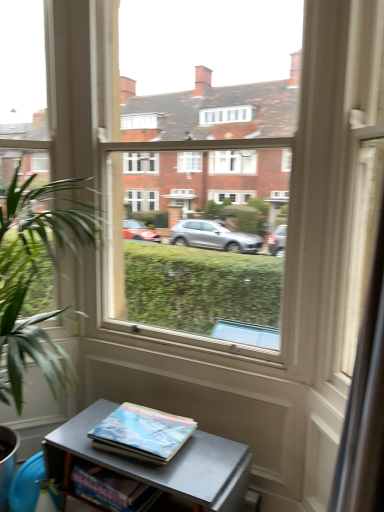
Question: Considering the relative sizes of green leafy plant at left and hardcover book at center, marked as the 1th book in a top-to-bottom arrangement, in the image provided, is green leafy plant at left taller than hardcover book at center, marked as the 1th book in a top-to-bottom arrangement,?

Choices:
 (A) yes
 (B) no

Answer: (A)

Question: From the image's perspective, is green leafy plant at left under hardcover book at center, marked as the 1th book in a top-to-bottom arrangement?

Choices:
 (A) yes
 (B) no

Answer: (B)

Question: Does green leafy plant at left have a lesser height compared to hardcover book at center, marked as the 1th book in a top-to-bottom arrangement?

Choices:
 (A) no
 (B) yes

Answer: (A)

Question: From the image's perspective, is green leafy plant at left above hardcover book at center, the second book ordered from the bottom?

Choices:
 (A) no
 (B) yes

Answer: (B)

Question: Is green leafy plant at left with hardcover book at center, marked as the 1th book in a top-to-bottom arrangement?

Choices:
 (A) no
 (B) yes

Answer: (A)

Question: Considering the relative positions of green leafy plant at left and hardcover book at center, marked as the 1th book in a top-to-bottom arrangement, in the image provided, is green leafy plant at left to the left of hardcover book at center, marked as the 1th book in a top-to-bottom arrangement, from the viewer's perspective?

Choices:
 (A) yes
 (B) no

Answer: (A)

Question: Does hardcover book at center, marked as the 1th book in a top-to-bottom arrangement, appear on the right side of metallic gray table at lower center?

Choices:
 (A) yes
 (B) no

Answer: (B)

Question: From a real-world perspective, is hardcover book at center, the second book ordered from the bottom, beneath metallic gray table at lower center?

Choices:
 (A) no
 (B) yes

Answer: (A)

Question: From the image's perspective, is hardcover book at center, marked as the 1th book in a top-to-bottom arrangement, located above metallic gray table at lower center?

Choices:
 (A) no
 (B) yes

Answer: (B)

Question: Would you say metallic gray table at lower center is part of hardcover book at center, marked as the 1th book in a top-to-bottom arrangement,'s contents?

Choices:
 (A) yes
 (B) no

Answer: (B)

Question: Can you confirm if hardcover book at center, marked as the 1th book in a top-to-bottom arrangement, is positioned to the left of metallic gray table at lower center?

Choices:
 (A) no
 (B) yes

Answer: (B)

Question: Is hardcover book at center, marked as the 1th book in a top-to-bottom arrangement, taller than metallic gray table at lower center?

Choices:
 (A) no
 (B) yes

Answer: (A)

Question: Can we say hardcover book at lower center, which appears as the 1th book when ordered from the bottom, lies outside transparent glass door at center?

Choices:
 (A) yes
 (B) no

Answer: (A)